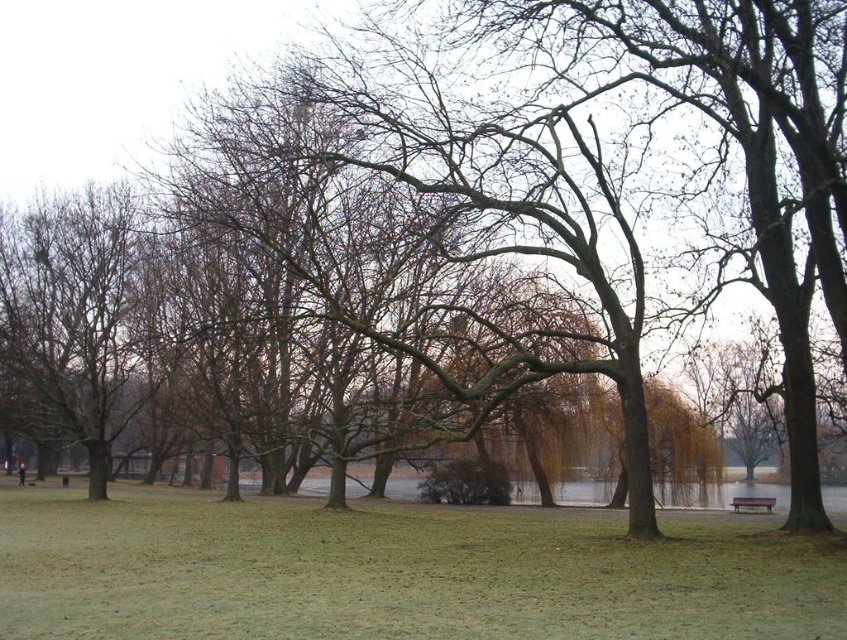
Question: Among these points, which one is farthest from the camera?

Choices:
 (A) (231, 561)
 (B) (773, 499)

Answer: (B)

Question: Is green grassy at center positioned behind wooden bench at lower right?

Choices:
 (A) yes
 (B) no

Answer: (B)

Question: Is green grassy at center to the right of wooden bench at lower right from the viewer's perspective?

Choices:
 (A) yes
 (B) no

Answer: (B)

Question: Which point is farther to the camera?

Choices:
 (A) (768, 512)
 (B) (583, 540)

Answer: (A)

Question: Can you confirm if green grassy at center is positioned to the left of wooden bench at lower right?

Choices:
 (A) yes
 (B) no

Answer: (A)